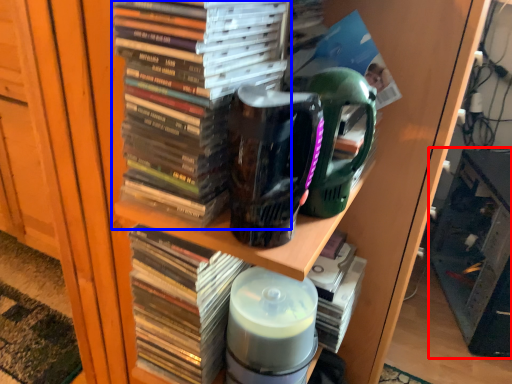
Question: Which object is further to the camera taking this photo, shelf (highlighted by a red box) or book (highlighted by a blue box)?

Choices:
 (A) shelf
 (B) book

Answer: (A)